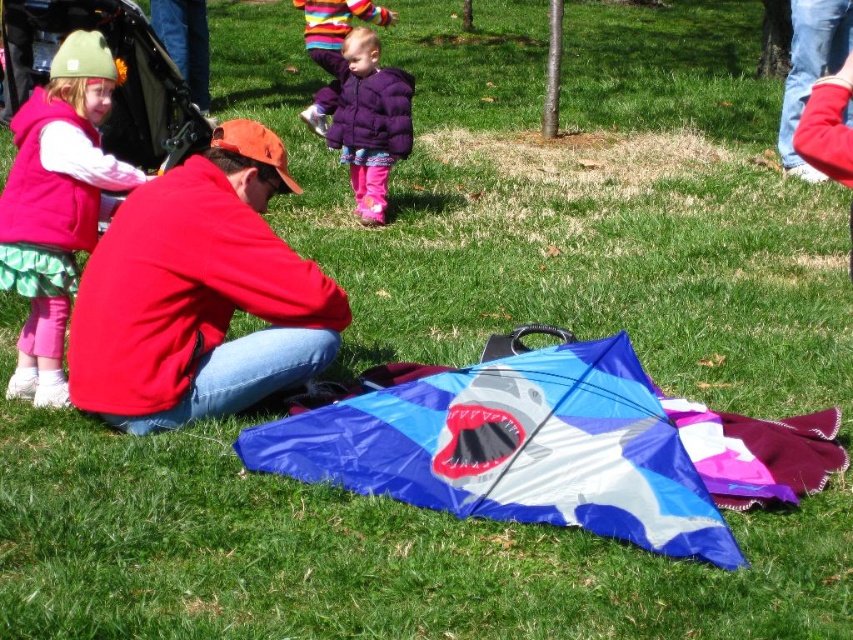
You are standing at point A which is at coordinates point (67,44) and you want to walk to point B which is at coordinates point (399,401). Which direction should you move in to reach point B from point A?

To reach point B from point A, you should move forward since point B is in front of point A.

You are a photographer trying to capture a photo of the blue fabric kite at center and the red fleece jacket at center from above. Which object will appear wider in the photo?

The blue fabric kite at center will appear wider in the photo because its width surpasses that of the red fleece jacket at center.

You are standing at the origin point in the park scene. The blue fabric kite at center is located at coordinates point (515, 449). If you want to walk directly to the blue fabric kite at center, which direction should you head?

The blue fabric kite at center is located at coordinates point (515, 449), so you should head towards the center of the image to reach it.